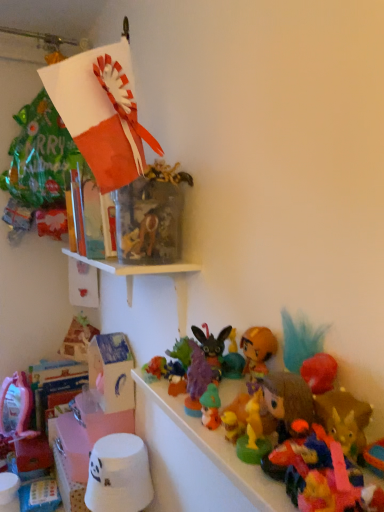
Question: From the image's perspective, is plush multicolored toy at lower right, the 11th toy in the left-to-right sequence, beneath white matte bucket at lower left, arranged as the tenth toy when viewed from the front?

Choices:
 (A) yes
 (B) no

Answer: (B)

Question: Is plush multicolored toy at lower right, arranged as the eleventh toy when viewed from the back, placed right next to white matte bucket at lower left, the second toy in the left-to-right sequence?

Choices:
 (A) no
 (B) yes

Answer: (A)

Question: Does plush multicolored toy at lower right, placed as the first toy when sorted from front to back, have a smaller size compared to white matte bucket at lower left, the second toy in the left-to-right sequence?

Choices:
 (A) no
 (B) yes

Answer: (B)

Question: From a real-world perspective, does plush multicolored toy at lower right, placed as the first toy when sorted from front to back, stand above white matte bucket at lower left, which is the 10th toy from right to left?

Choices:
 (A) yes
 (B) no

Answer: (A)

Question: Could you tell me if plush multicolored toy at lower right, arranged as the eleventh toy when viewed from the back, is turned towards white matte bucket at lower left, which is the 2th toy from back to front?

Choices:
 (A) no
 (B) yes

Answer: (A)

Question: Considering the relative sizes of plush multicolored toy at lower right, placed as the first toy when sorted from front to back, and white matte bucket at lower left, which is the 2th toy from back to front, in the image provided, is plush multicolored toy at lower right, placed as the first toy when sorted from front to back, shorter than white matte bucket at lower left, which is the 2th toy from back to front,?

Choices:
 (A) no
 (B) yes

Answer: (B)

Question: Is translucent plastic toy at center, which is the third toy from left to right, in contact with plush green rabbit at center, the 5th toy viewed from the right?

Choices:
 (A) no
 (B) yes

Answer: (A)

Question: Is translucent plastic toy at center, arranged as the 9th toy when viewed from the right, positioned behind plush green rabbit at center, which appears as the ninth toy when viewed from the back?

Choices:
 (A) no
 (B) yes

Answer: (B)

Question: Can you confirm if translucent plastic toy at center, which is the 4th toy in back-to-front order, is positioned to the left of plush green rabbit at center, which is the 3th toy from front to back?

Choices:
 (A) yes
 (B) no

Answer: (A)

Question: Can you confirm if translucent plastic toy at center, which appears as the eighth toy when viewed from the front, is shorter than plush green rabbit at center, which is the 3th toy from front to back?

Choices:
 (A) yes
 (B) no

Answer: (A)

Question: From the image's perspective, is translucent plastic toy at center, arranged as the 9th toy when viewed from the right, below plush green rabbit at center, which is the 3th toy from front to back?

Choices:
 (A) yes
 (B) no

Answer: (B)

Question: From the image's perspective, is plush brown bear at center, arranged as the 3th toy when viewed from the right, below pink fabric doll at lower left, marked as the first toy in a left-to-right arrangement?

Choices:
 (A) no
 (B) yes

Answer: (A)